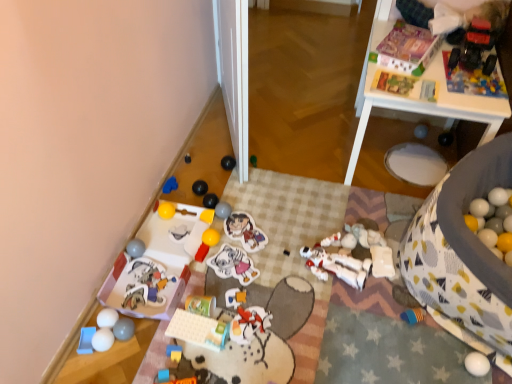
Identify the location of vacant space to the right of yellow matte ball at center, which appears as the thirteenth toy when viewed from the left. The image size is (512, 384). (247, 223).